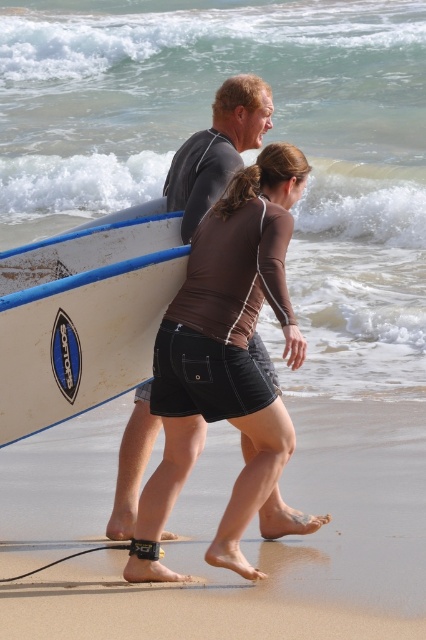
Is point (204, 588) positioned behind point (37, 288)?

That is True.

Where is `black fabric shorts at center`? Image resolution: width=426 pixels, height=640 pixels. black fabric shorts at center is located at coordinates (275, 544).

This screenshot has width=426, height=640. Identify the location of black fabric shorts at center. (275, 544).

Can you confirm if black fabric shorts at center is wider than brown matte shorts at center?

Correct, the width of black fabric shorts at center exceeds that of brown matte shorts at center.

Is black fabric shorts at center below brown matte shorts at center?

Correct, black fabric shorts at center is located below brown matte shorts at center.

Between point (40, 464) and point (224, 376), which one is positioned in front?

Point (224, 376) is in front.

Locate an element on the screen. This screenshot has height=640, width=426. black fabric shorts at center is located at coordinates (275, 544).

Is brown matte shorts at center in front of white matte surfboard at left?

Yes, it is in front of white matte surfboard at left.

Between brown matte shorts at center and white matte surfboard at left, which one has more height?

With more height is brown matte shorts at center.

Between point (180, 342) and point (32, 344), which one is positioned behind?

Positioned behind is point (180, 342).

Image resolution: width=426 pixels, height=640 pixels. Identify the location of brown matte shorts at center. (227, 365).